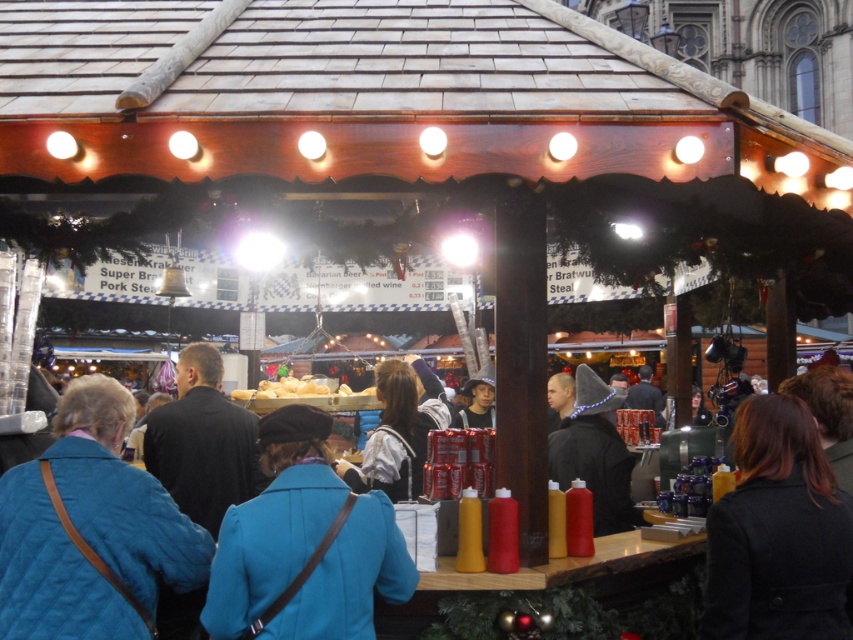
Question: Among these points, which one is nearest to the camera?

Choices:
 (A) (236, 632)
 (B) (74, 525)

Answer: (A)

Question: Where is dark brown leather coat at lower right located in relation to black woolen hat at center in the image?

Choices:
 (A) left
 (B) right

Answer: (B)

Question: Which point is farther from the camera taking this photo?

Choices:
 (A) (781, 541)
 (B) (79, 400)
 (C) (270, 577)

Answer: (B)

Question: Where is blue quilted coat at center located in relation to black woolen hat at center in the image?

Choices:
 (A) above
 (B) below

Answer: (B)

Question: Which point is closer to the camera?

Choices:
 (A) (824, 616)
 (B) (114, 440)
 (C) (618, 493)
 (D) (252, 624)

Answer: (D)

Question: Does blue quilted coat at center appear on the right side of black woolen hat at center?

Choices:
 (A) no
 (B) yes

Answer: (A)